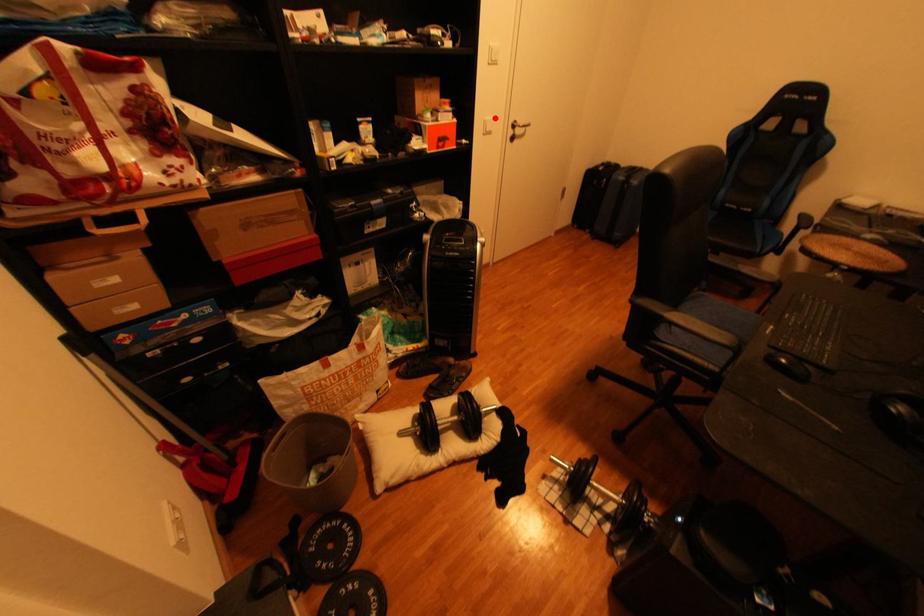
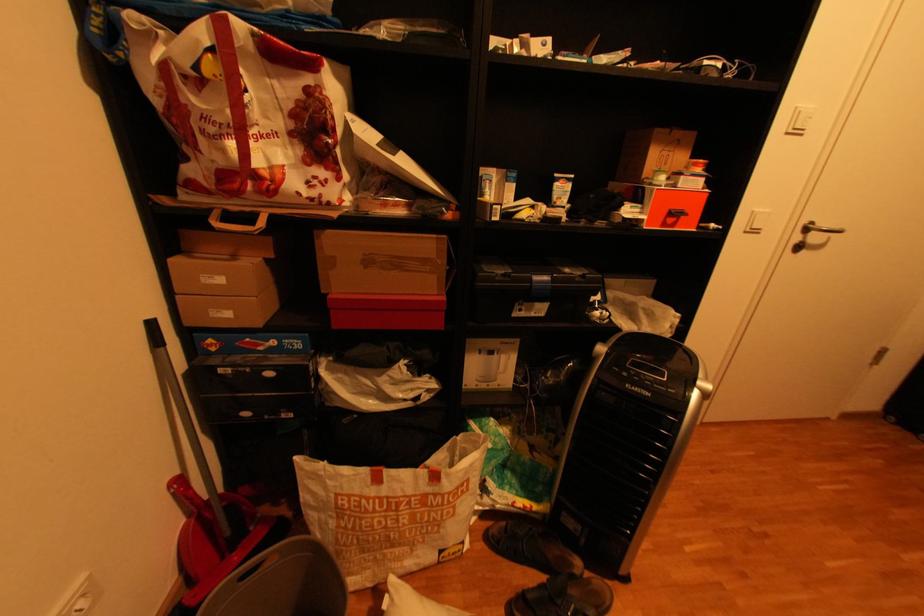
Locate, in the second image, the point that corresponds to the highlighted location in the first image.

(766, 209)